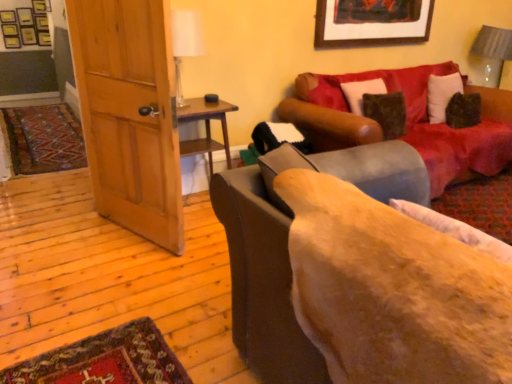
Where is `free space in front of wooden door at left`? The height and width of the screenshot is (384, 512). free space in front of wooden door at left is located at coordinates 113,278.